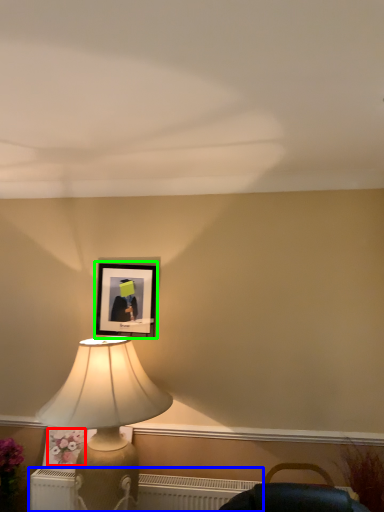
Question: Which object is positioned closest to flower (highlighted by a red box)? Select from radiator (highlighted by a blue box) and picture frame (highlighted by a green box).

Choices:
 (A) radiator
 (B) picture frame

Answer: (A)